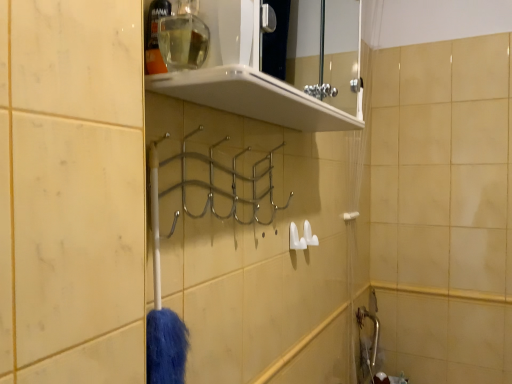
Find the location of `white plastic towel bar at right`. white plastic towel bar at right is located at coordinates (350, 215).

Identify the location of translucent plastic shower curtain at right. The height and width of the screenshot is (384, 512). (362, 102).

What do you see at coordinates (362, 102) in the screenshot?
I see `translucent plastic shower curtain at right` at bounding box center [362, 102].

Locate an element on the screen. chrome metallic hanger at center is located at coordinates (222, 189).

What are the coordinates of `clear glass bottle at upper center, marked as the second toiletry in a left-to-right arrangement` in the screenshot? It's located at (183, 37).

Considering the relative sizes of translucent plastic shower curtain at right and white glossy shelf at upper center in the image provided, is translucent plastic shower curtain at right wider than white glossy shelf at upper center?

No.

Locate an element on the screen. The height and width of the screenshot is (384, 512). shelf in front of the translucent plastic shower curtain at right is located at coordinates (278, 64).

From the image's perspective, does translucent plastic shower curtain at right appear lower than white glossy shelf at upper center?

Yes, from the image's perspective, translucent plastic shower curtain at right is below white glossy shelf at upper center.

Is translucent plastic shower curtain at right taller than white glossy shelf at upper center?

Yes, translucent plastic shower curtain at right is taller than white glossy shelf at upper center.

Are white glossy shelf at upper center and translucent plastic shower curtain at right making contact?

No, white glossy shelf at upper center is not beside translucent plastic shower curtain at right.

Which is farther, (330,45) or (355,347)?

The point (330,45) is farther from the camera.

How many degrees apart are the facing directions of white glossy shelf at upper center and translucent plastic shower curtain at right?

white glossy shelf at upper center and translucent plastic shower curtain at right are facing 0.328 degrees away from each other.

Does clear plastic bottle at upper center, the first toiletry viewed from the left, have a smaller size compared to white glossy shelf at upper center?

Yes, clear plastic bottle at upper center, the first toiletry viewed from the left, is smaller than white glossy shelf at upper center.

From a real-world perspective, is clear plastic bottle at upper center, the 2th toiletry in the right-to-left sequence, physically below white glossy shelf at upper center?

Yes, from a real-world perspective, clear plastic bottle at upper center, the 2th toiletry in the right-to-left sequence, is beneath white glossy shelf at upper center.

From the image's perspective, which is below, clear plastic bottle at upper center, the 2th toiletry in the right-to-left sequence, or white glossy shelf at upper center?

clear plastic bottle at upper center, the 2th toiletry in the right-to-left sequence, from the image's perspective.

From a real-world perspective, is white plastic towel bar at right on top of translucent plastic shower curtain at right?

Actually, white plastic towel bar at right is physically below translucent plastic shower curtain at right in the real world.

Is white plastic towel bar at right taller than translucent plastic shower curtain at right?

In fact, white plastic towel bar at right may be shorter than translucent plastic shower curtain at right.

Does point (347, 212) lie in front of point (356, 199)?

Yes, point (347, 212) is in front of point (356, 199).

Is white plastic towel bar at right closer to the viewer compared to translucent plastic shower curtain at right?

No, white plastic towel bar at right is behind translucent plastic shower curtain at right.

Would you say chrome metallic hanger at center is a long distance from translucent plastic shower curtain at right?

No, chrome metallic hanger at center is in close proximity to translucent plastic shower curtain at right.

Considering the sizes of objects chrome metallic hanger at center and translucent plastic shower curtain at right in the image provided, who is smaller, chrome metallic hanger at center or translucent plastic shower curtain at right?

With smaller size is chrome metallic hanger at center.

Between chrome metallic hanger at center and translucent plastic shower curtain at right, which one has more height?

Standing taller between the two is translucent plastic shower curtain at right.

Is translucent plastic shower curtain at right positioned with its back to clear plastic bottle at upper center, the first toiletry viewed from the left?

No, translucent plastic shower curtain at right's orientation is not away from clear plastic bottle at upper center, the first toiletry viewed from the left.

Is point (351, 258) farther from camera compared to point (158, 53)?

Yes, point (351, 258) is behind point (158, 53).

Is translucent plastic shower curtain at right bigger or smaller than clear plastic bottle at upper center, the first toiletry viewed from the left?

translucent plastic shower curtain at right is bigger than clear plastic bottle at upper center, the first toiletry viewed from the left.

Based on the photo, are translucent plastic shower curtain at right and clear plastic bottle at upper center, the first toiletry viewed from the left, beside each other?

No, translucent plastic shower curtain at right is not with clear plastic bottle at upper center, the first toiletry viewed from the left.

Considering the points (182, 4) and (255, 188), which point is in front, point (182, 4) or point (255, 188)?

The point (182, 4) is in front.

Which of these two, clear glass bottle at upper center, marked as the second toiletry in a left-to-right arrangement, or chrome metallic hanger at center, is smaller?

Smaller between the two is clear glass bottle at upper center, marked as the second toiletry in a left-to-right arrangement.

Would you say clear glass bottle at upper center, marked as the second toiletry in a left-to-right arrangement, is to the left or to the right of chrome metallic hanger at center in the picture?

Based on their positions, clear glass bottle at upper center, marked as the second toiletry in a left-to-right arrangement, is located to the left of chrome metallic hanger at center.

This screenshot has width=512, height=384. There is a chrome metallic hanger at center. Identify the location of the 2nd toiletry above it (from the image's perspective). (183, 37).

I want to click on shelf in front of the translucent plastic shower curtain at right, so click(x=278, y=64).

Where is `shower curtain located behind the white glossy shelf at upper center`? shower curtain located behind the white glossy shelf at upper center is located at coordinates (362, 102).

When comparing their distances from clear glass bottle at upper center, the first toiletry from the right, does white plastic towel bar at right or white glossy shelf at upper center seem closer?

white plastic towel bar at right lies closer to clear glass bottle at upper center, the first toiletry from the right, than the other object.

Based on their spatial positions, is white plastic towel bar at right or white glossy shelf at upper center further from chrome metallic hanger at center?

Based on the image, white glossy shelf at upper center appears to be further to chrome metallic hanger at center.

In the scene shown: Estimate the real-world distances between objects in this image. Which object is closer to white glossy shelf at upper center, clear glass bottle at upper center, marked as the second toiletry in a left-to-right arrangement, or clear plastic bottle at upper center, the first toiletry viewed from the left?

clear glass bottle at upper center, marked as the second toiletry in a left-to-right arrangement, lies closer to white glossy shelf at upper center than the other object.

Estimate the real-world distances between objects in this image. Which object is further from white plastic towel bar at right, translucent plastic shower curtain at right or chrome metallic hanger at center?

Based on the image, chrome metallic hanger at center appears to be further to white plastic towel bar at right.

Considering their positions, is white plastic towel bar at right positioned further to white glossy shelf at upper center than chrome metallic hanger at center?

chrome metallic hanger at center is further to white glossy shelf at upper center.

Estimate the real-world distances between objects in this image. Which object is further from clear plastic bottle at upper center, the first toiletry viewed from the left, chrome metallic hanger at center or clear glass bottle at upper center, marked as the second toiletry in a left-to-right arrangement?

Based on the image, chrome metallic hanger at center appears to be further to clear plastic bottle at upper center, the first toiletry viewed from the left.

Looking at the image, which one is located closer to clear glass bottle at upper center, the first toiletry from the right, chrome metallic hanger at center or white glossy shelf at upper center?

The object closer to clear glass bottle at upper center, the first toiletry from the right, is chrome metallic hanger at center.

Which object lies nearer to the anchor point clear glass bottle at upper center, the first toiletry from the right, clear plastic bottle at upper center, the 2th toiletry in the right-to-left sequence, or white plastic towel bar at right?

clear plastic bottle at upper center, the 2th toiletry in the right-to-left sequence, is positioned closer to the anchor clear glass bottle at upper center, the first toiletry from the right.

Locate an element on the screen. This screenshot has height=384, width=512. shower curtain positioned between chrome metallic hanger at center and white plastic towel bar at right from near to far is located at coordinates (x=362, y=102).

Where is `toiletry between clear glass bottle at upper center, the first toiletry from the right, and white plastic towel bar at right in the front-back direction`? The height and width of the screenshot is (384, 512). toiletry between clear glass bottle at upper center, the first toiletry from the right, and white plastic towel bar at right in the front-back direction is located at coordinates (155, 37).

What are the coordinates of `shower curtain positioned between clear glass bottle at upper center, marked as the second toiletry in a left-to-right arrangement, and white plastic towel bar at right from near to far` in the screenshot? It's located at (362, 102).

The width and height of the screenshot is (512, 384). Identify the location of hanger positioned between white glossy shelf at upper center and translucent plastic shower curtain at right from near to far. (222, 189).